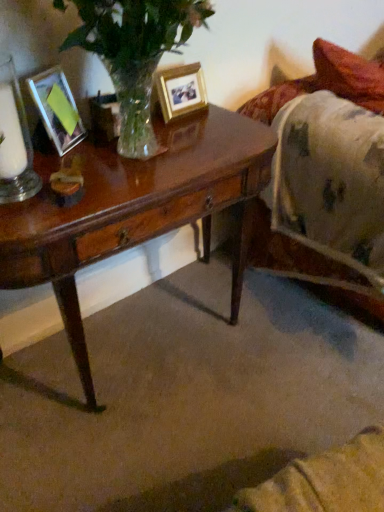
You are a GUI agent. You are given a task and a screenshot of the screen. Output one action in this format:
    pyautogui.click(x=<x>, y=<y>)
    Task: Click on the free space in front of gold metallic photo frame at upper center, which ranks as the 2th picture frame in front-to-back order
    This screenshot has width=384, height=512.
    Given the screenshot: What is the action you would take?
    tap(195, 132)